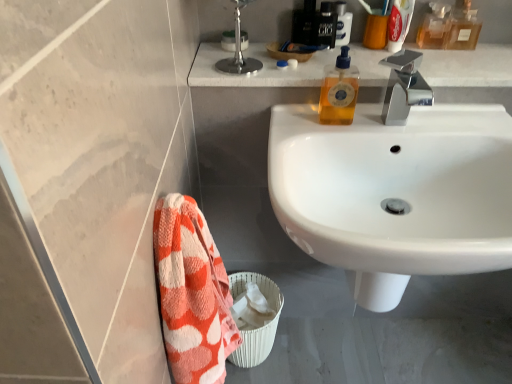
Locate an element on the screen. vacant space situated on the left part of shiny black bottle at upper center, the 2th toiletry in the back-to-front sequence is located at coordinates (254, 55).